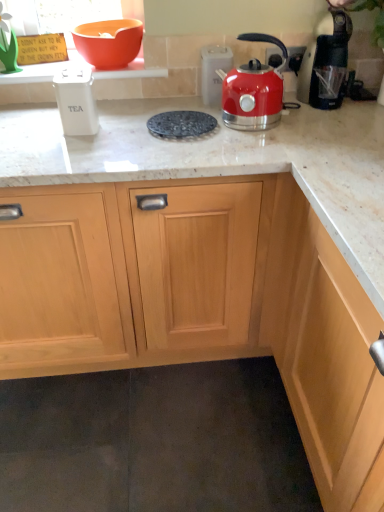
Question: From the image's perspective, is metallic silver outlet at upper right under orange matte bowl at upper left?

Choices:
 (A) no
 (B) yes

Answer: (B)

Question: Does metallic silver outlet at upper right have a greater width compared to orange matte bowl at upper left?

Choices:
 (A) yes
 (B) no

Answer: (B)

Question: From the image's perspective, would you say metallic silver outlet at upper right is positioned over orange matte bowl at upper left?

Choices:
 (A) yes
 (B) no

Answer: (B)

Question: Can you confirm if metallic silver outlet at upper right is positioned to the right of orange matte bowl at upper left?

Choices:
 (A) yes
 (B) no

Answer: (A)

Question: From a real-world perspective, is metallic silver outlet at upper right physically below orange matte bowl at upper left?

Choices:
 (A) no
 (B) yes

Answer: (B)

Question: Is white plastic tea container at left, which appears as the 4th kitchen appliance when viewed from the right, wider or thinner than metallic silver kettle at upper right, placed as the 2th kitchen appliance when sorted from left to right?

Choices:
 (A) thin
 (B) wide

Answer: (B)

Question: Would you say white plastic tea container at left, which appears as the 4th kitchen appliance when viewed from the right, is to the left or to the right of metallic silver kettle at upper right, acting as the third kitchen appliance starting from the right, in the picture?

Choices:
 (A) left
 (B) right

Answer: (A)

Question: Is white plastic tea container at left, which appears as the 4th kitchen appliance when viewed from the right, inside the boundaries of metallic silver kettle at upper right, placed as the 2th kitchen appliance when sorted from left to right, or outside?

Choices:
 (A) outside
 (B) inside

Answer: (A)

Question: In the image, is white plastic tea container at left, the 1th kitchen appliance viewed from the left, positioned in front of or behind metallic silver kettle at upper right, acting as the third kitchen appliance starting from the right?

Choices:
 (A) front
 (B) behind

Answer: (A)

Question: Considering their positions, is metallic silver outlet at upper right located in front of or behind white plastic tea container at left, which appears as the 4th kitchen appliance when viewed from the right?

Choices:
 (A) front
 (B) behind

Answer: (B)

Question: Based on their sizes in the image, would you say metallic silver outlet at upper right is bigger or smaller than white plastic tea container at left, the 1th kitchen appliance viewed from the left?

Choices:
 (A) big
 (B) small

Answer: (B)

Question: Considering the relative positions of metallic silver outlet at upper right and white plastic tea container at left, which appears as the 4th kitchen appliance when viewed from the right, in the image provided, is metallic silver outlet at upper right to the left or to the right of white plastic tea container at left, which appears as the 4th kitchen appliance when viewed from the right,?

Choices:
 (A) left
 (B) right

Answer: (B)

Question: Do you think metallic silver outlet at upper right is within white plastic tea container at left, the 1th kitchen appliance viewed from the left, or outside of it?

Choices:
 (A) outside
 (B) inside

Answer: (A)

Question: Considering the relative positions of orange matte bowl at upper left and metallic silver outlet at upper right in the image provided, is orange matte bowl at upper left to the left or to the right of metallic silver outlet at upper right?

Choices:
 (A) left
 (B) right

Answer: (A)

Question: Is orange matte bowl at upper left situated inside metallic silver outlet at upper right or outside?

Choices:
 (A) outside
 (B) inside

Answer: (A)